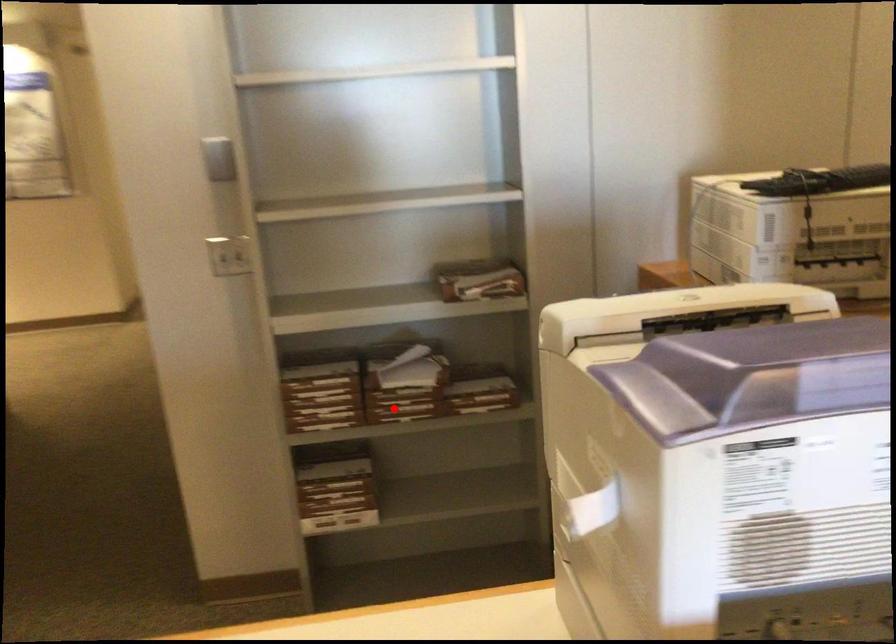
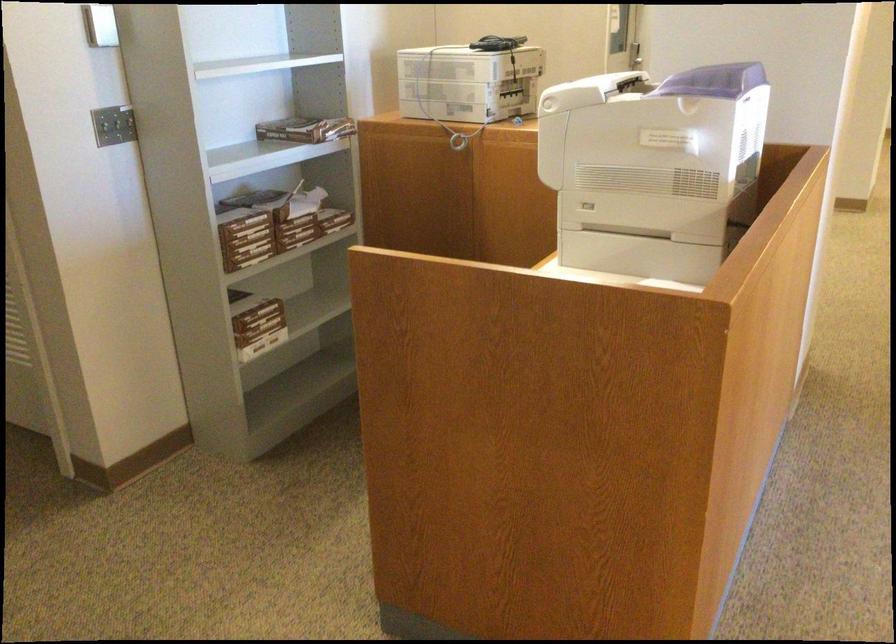
Question: A red point is marked in image1. In image2, is the corresponding 3D point closer to the camera or farther? Reply with the corresponding letter.

Choices:
 (A) The corresponding 3D point is closer.
 (B) The corresponding 3D point is farther.

Answer: (B)